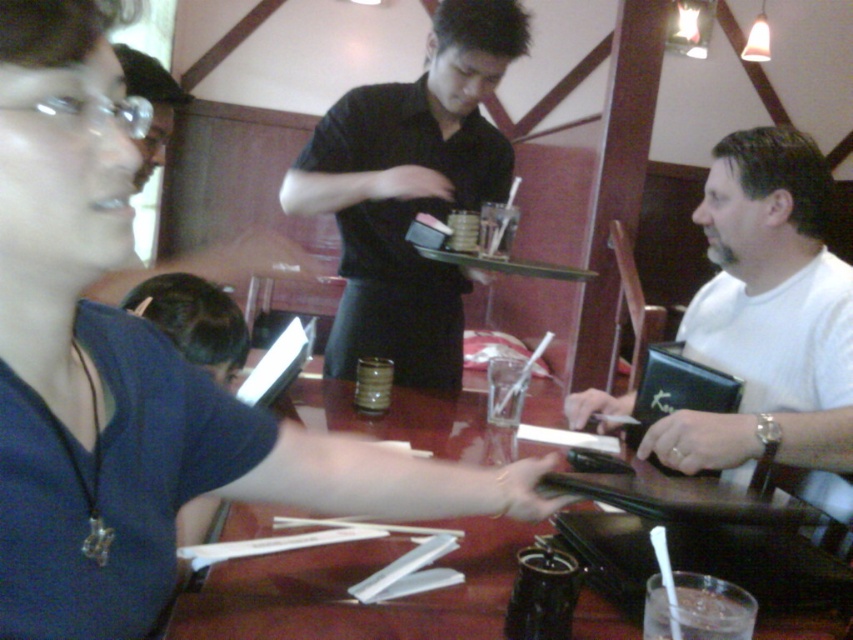
Question: Which of the following is the closest to the observer?

Choices:
 (A) clear glass at table center
 (B) matte blue shirt at center

Answer: (B)

Question: Observing the image, what is the correct spatial positioning of white matte wallet at right in reference to wooden table at center?

Choices:
 (A) below
 (B) above

Answer: (B)

Question: Which object is the closest to the clear glass at table center?

Choices:
 (A) white matte wallet at right
 (B) black shirt at center

Answer: (A)

Question: Where is matte blue shirt at center located in relation to wooden table at center in the image?

Choices:
 (A) right
 (B) left

Answer: (B)

Question: Considering the relative positions of white matte wallet at right and clear glass at table center in the image provided, where is white matte wallet at right located with respect to clear glass at table center?

Choices:
 (A) right
 (B) left

Answer: (A)

Question: Which of the following is the closest to the observer?

Choices:
 (A) (27, 513)
 (B) (392, 412)
 (C) (747, 600)

Answer: (A)